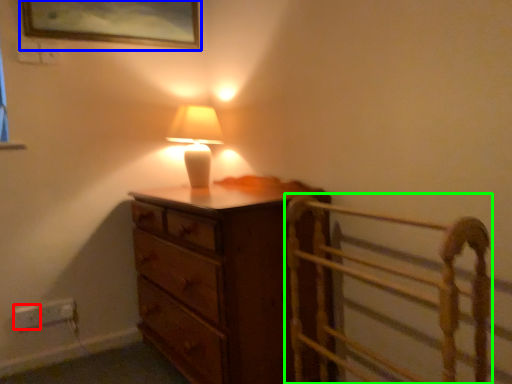
Question: Which object is positioned closest to electric outlet (highlighted by a red box)? Select from picture frame (highlighted by a blue box) and bed frame (highlighted by a green box).

Choices:
 (A) picture frame
 (B) bed frame

Answer: (A)